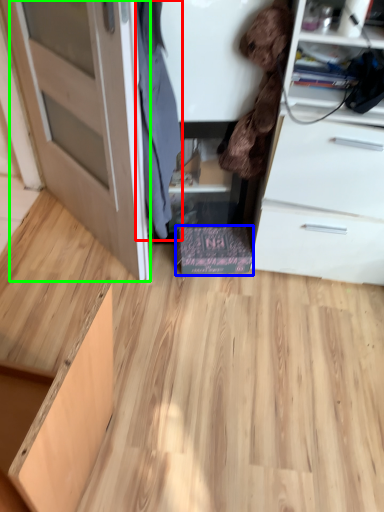
Question: Considering the real-world distances, which object is farthest from clothing (highlighted by a red box)? cabinetry (highlighted by a blue box) or door (highlighted by a green box)?

Choices:
 (A) cabinetry
 (B) door

Answer: (A)